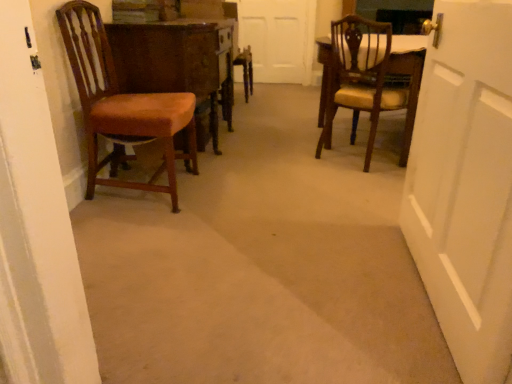
Question: Does wooden polished table at left turn towards white matte door at center?

Choices:
 (A) no
 (B) yes

Answer: (A)

Question: From a real-world perspective, does wooden polished table at left sit lower than white matte door at center?

Choices:
 (A) yes
 (B) no

Answer: (A)

Question: Can you confirm if wooden polished table at left is bigger than white matte door at center?

Choices:
 (A) no
 (B) yes

Answer: (B)

Question: Is wooden polished table at left shorter than white matte door at center?

Choices:
 (A) no
 (B) yes

Answer: (B)

Question: Is wooden polished table at left oriented away from white matte door at center?

Choices:
 (A) yes
 (B) no

Answer: (B)

Question: Does wooden polished table at left have a greater width compared to white matte door at center?

Choices:
 (A) no
 (B) yes

Answer: (B)

Question: Is white matte door at center facing away from wooden polished table at left?

Choices:
 (A) yes
 (B) no

Answer: (B)

Question: Does white matte door at center have a smaller size compared to wooden polished table at left?

Choices:
 (A) yes
 (B) no

Answer: (A)

Question: From a real-world perspective, is white matte door at center over wooden polished table at left?

Choices:
 (A) yes
 (B) no

Answer: (A)

Question: Is wooden polished table at left inside white matte door at center?

Choices:
 (A) yes
 (B) no

Answer: (B)

Question: From the image's perspective, would you say white matte door at center is shown under wooden polished table at left?

Choices:
 (A) yes
 (B) no

Answer: (B)

Question: Does white matte door at center have a lesser height compared to wooden polished table at left?

Choices:
 (A) yes
 (B) no

Answer: (B)

Question: From the image's perspective, would you say matte brown chair at right, which is the second chair from left to right, is positioned over matte brown chair at left, which ranks as the 1th chair in left-to-right order?

Choices:
 (A) no
 (B) yes

Answer: (B)